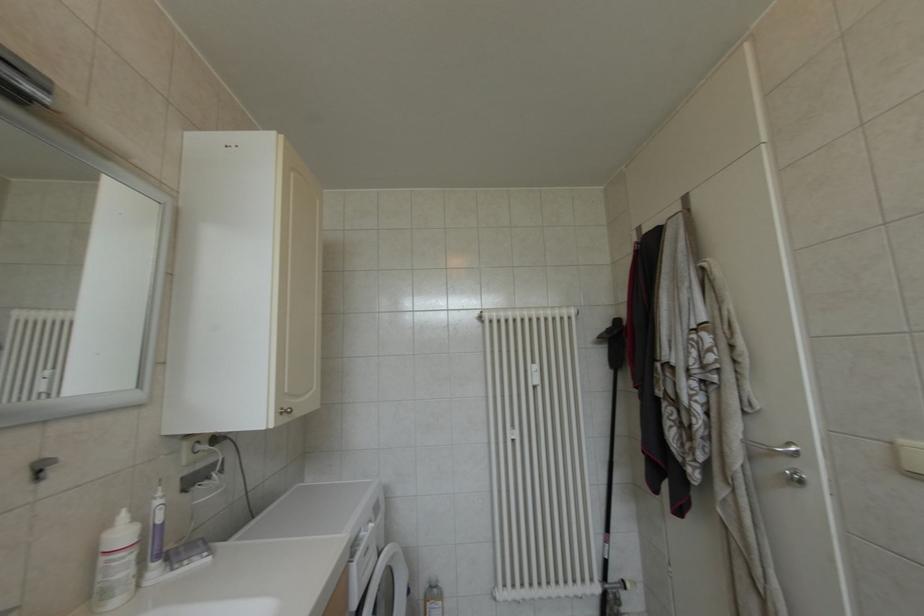
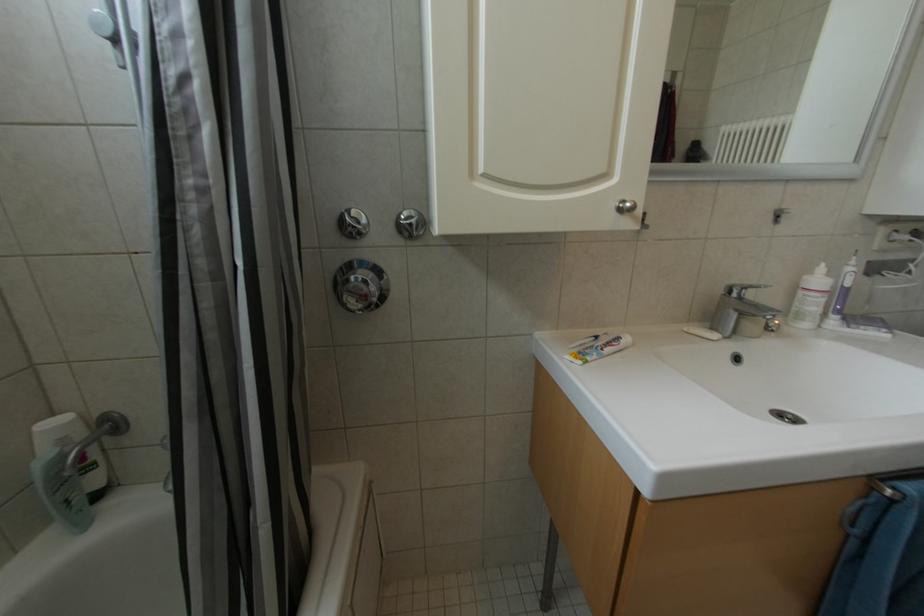
Based on the continuous images, in which direction is the camera rotating?

The camera rotated toward left-down.